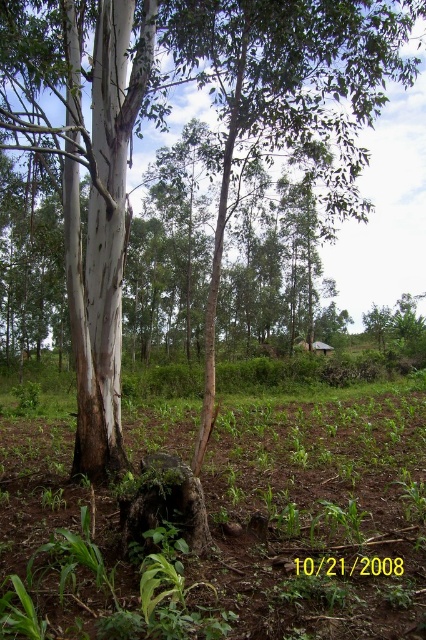
You are standing at the point with coordinates 0.7, 0.5 in the image. You want to walk towards the brown soil at center. In which direction should you move?

The brown soil at center is located at coordinates (230, 531). Since you are at (213, 448), you should move northeast to reach it.

You are standing in the rural landscape and want to walk from the tree stump to the field. You notice two points marked in the image. Which point, point (103, 508) or point (152, 465), is closer to your current position near the tree stump?

Point (103, 508) is closer to your current position near the tree stump because it is further to the viewer than point (152, 465).

You are a farmer checking the growth of your crops. You notice the brown soil at center and the brown rough stump at center in your field. Which one is wider?

The brown soil at center is wider than the brown rough stump at center.